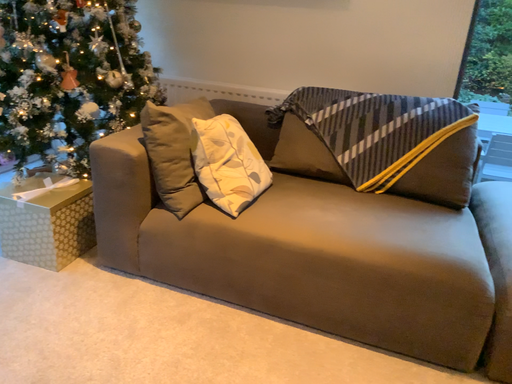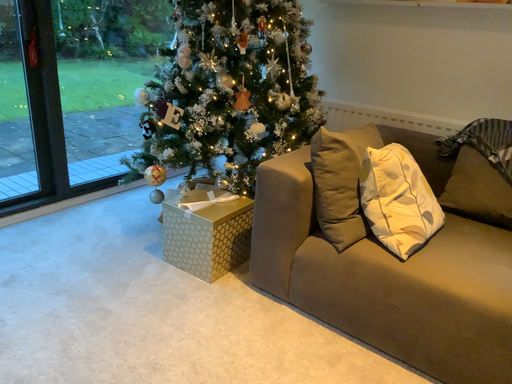
Question: How did the camera likely rotate when shooting the video?

Choices:
 (A) rotated right
 (B) rotated left

Answer: (B)